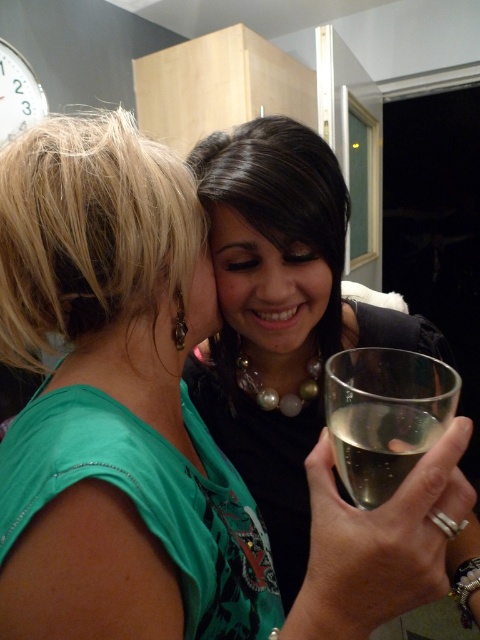
Question: Is clear glass wine glass at lower right to the right of smooth skin at center from the viewer's perspective?

Choices:
 (A) no
 (B) yes

Answer: (B)

Question: Does clear glass wine glass at lower right have a smaller size compared to smooth skin at center?

Choices:
 (A) no
 (B) yes

Answer: (A)

Question: Which object is closer to the camera taking this photo?

Choices:
 (A) smooth skin at center
 (B) clear glass wine glass at lower right

Answer: (B)

Question: Which point is farther to the camera?

Choices:
 (A) clear glass wine glass at lower right
 (B) smooth skin at center

Answer: (B)

Question: Which point is closer to the camera?

Choices:
 (A) (340, 376)
 (B) (228, 225)

Answer: (A)

Question: Is clear glass wine glass at lower right closer to the viewer compared to smooth skin at center?

Choices:
 (A) no
 (B) yes

Answer: (B)